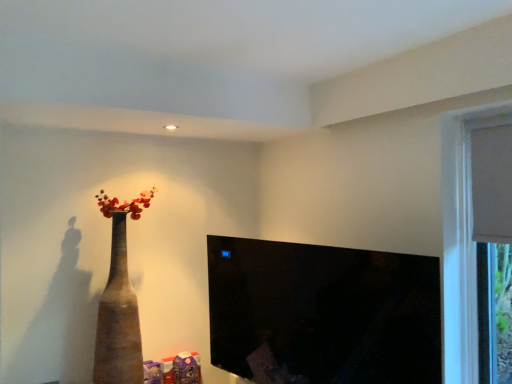
Describe the element at coordinates (323, 313) in the screenshot. The image size is (512, 384). I see `black glossy tv at center` at that location.

Measure the distance between black glossy tv at center and camera.

The distance of black glossy tv at center from camera is 2.78 meters.

Find the location of a particular element. The image size is (512, 384). black glossy tv at center is located at coordinates (323, 313).

Find the location of a particular element. The image size is (512, 384). brown matte vase at left is located at coordinates (118, 319).

What do you see at coordinates (118, 319) in the screenshot?
I see `brown matte vase at left` at bounding box center [118, 319].

The image size is (512, 384). What are the coordinates of `black glossy tv at center` in the screenshot? It's located at (323, 313).

Considering the relative positions of black glossy tv at center and brown matte vase at left in the image provided, is black glossy tv at center to the right of brown matte vase at left from the viewer's perspective?

Indeed, black glossy tv at center is positioned on the right side of brown matte vase at left.

Is black glossy tv at center closer to the viewer compared to brown matte vase at left?

Yes.

Which point is more distant from viewer, (414, 298) or (110, 326)?

Positioned behind is point (110, 326).

From the image's perspective, who appears lower, black glossy tv at center or brown matte vase at left?

From the image's view, black glossy tv at center is below.

From a real-world perspective, which is physically below, black glossy tv at center or brown matte vase at left?

black glossy tv at center, from a real-world perspective.

Looking at this image, is black glossy tv at center wider or thinner than brown matte vase at left?

black glossy tv at center is thinner than brown matte vase at left.

Considering the sizes of objects black glossy tv at center and brown matte vase at left in the image provided, who is taller, black glossy tv at center or brown matte vase at left?

brown matte vase at left is taller.

Is black glossy tv at center bigger than brown matte vase at left?

No.

Is black glossy tv at center situated inside brown matte vase at left or outside?

black glossy tv at center is not inside brown matte vase at left, it's outside.

Is black glossy tv at center placed right next to brown matte vase at left?

There is a gap between black glossy tv at center and brown matte vase at left.

Looking at this image, is black glossy tv at center turned away from brown matte vase at left?

No, black glossy tv at center is not facing away from brown matte vase at left.

How different are the orientations of black glossy tv at center and brown matte vase at left in degrees?

There is a 74.4-degree angle between the facing directions of black glossy tv at center and brown matte vase at left.

In the image, there is a brown matte vase at left. Identify the location of window screen below it (from the image's perspective). (323, 313).

In the image, is brown matte vase at left on the left side or the right side of black glossy tv at center?

brown matte vase at left is positioned on black glossy tv at center's left side.

Considering the positions of objects brown matte vase at left and black glossy tv at center in the image provided, who is in front, brown matte vase at left or black glossy tv at center?

black glossy tv at center is more forward.

Does point (137, 325) come closer to viewer compared to point (410, 322)?

That is True.

From the image's perspective, which one is positioned higher, brown matte vase at left or black glossy tv at center?

From the image's view, brown matte vase at left is above.

From a real-world perspective, is brown matte vase at left above or below black glossy tv at center?

brown matte vase at left is above black glossy tv at center.

Considering the relative sizes of brown matte vase at left and black glossy tv at center in the image provided, is brown matte vase at left wider than black glossy tv at center?

Correct, the width of brown matte vase at left exceeds that of black glossy tv at center.

Considering the relative sizes of brown matte vase at left and black glossy tv at center in the image provided, is brown matte vase at left shorter than black glossy tv at center?

In fact, brown matte vase at left may be taller than black glossy tv at center.

Between brown matte vase at left and black glossy tv at center, which one has smaller size?

black glossy tv at center is smaller.

Is brown matte vase at left completely or partially outside of black glossy tv at center?

Indeed, brown matte vase at left is completely outside black glossy tv at center.

Is brown matte vase at left beside black glossy tv at center?

No, brown matte vase at left is not making contact with black glossy tv at center.

Is black glossy tv at center at the back of brown matte vase at left?

brown matte vase at left does not have its back to black glossy tv at center.

Identify the location of window screen located underneath the brown matte vase at left (from a real-world perspective). (323, 313).

Identify the location of vase located above the black glossy tv at center (from a real-world perspective). This screenshot has height=384, width=512. (118, 319).

At what (x,y) coordinates should I click in order to perform the action: click on window screen located below the brown matte vase at left (from the image's perspective). Please return your answer as a coordinate pair (x, y). The image size is (512, 384). Looking at the image, I should click on (323, 313).